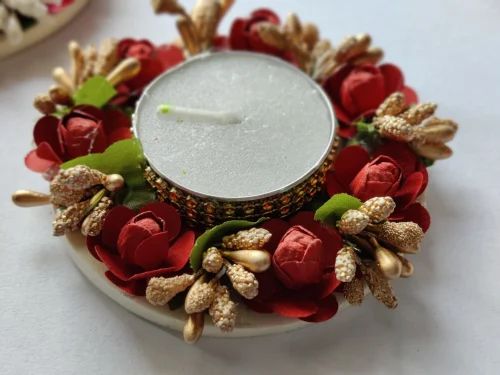
Locate an element on the screen. white tablecloth is located at coordinates (367, 341).